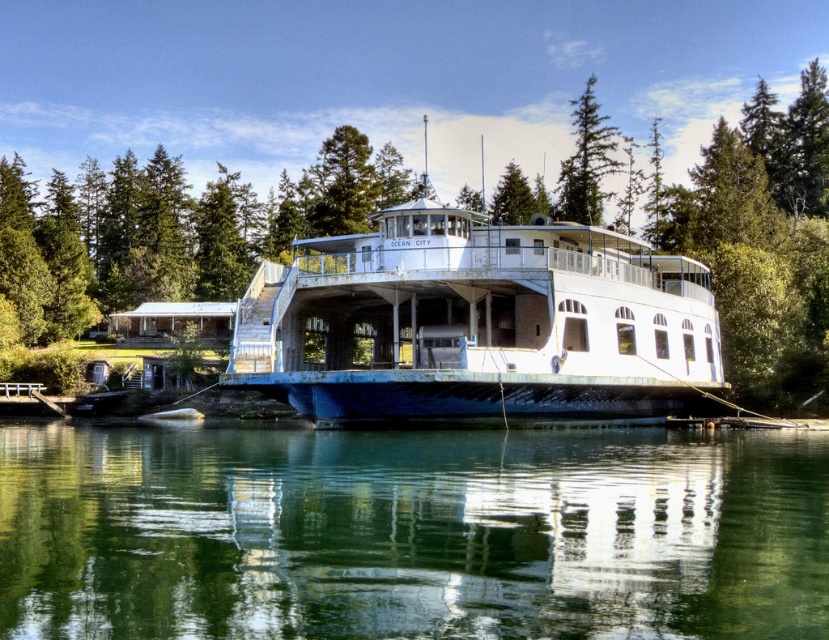
Question: Among these points, which one is nearest to the camera?

Choices:
 (A) (687, 308)
 (B) (526, 504)

Answer: (B)

Question: Is clear water at lower center above white matte boat at center?

Choices:
 (A) no
 (B) yes

Answer: (A)

Question: Is the position of white matte boat at center less distant than that of green textured pine tree at upper center?

Choices:
 (A) no
 (B) yes

Answer: (B)

Question: Which of these objects is positioned farthest from the green textured pine tree at upper center?

Choices:
 (A) clear water at lower center
 (B) white matte boat at center

Answer: (A)

Question: Can you confirm if clear water at lower center is positioned to the right of white matte boat at center?

Choices:
 (A) yes
 (B) no

Answer: (B)

Question: Which of the following is the closest to the observer?

Choices:
 (A) (575, 595)
 (B) (579, 170)
 (C) (587, 260)

Answer: (A)